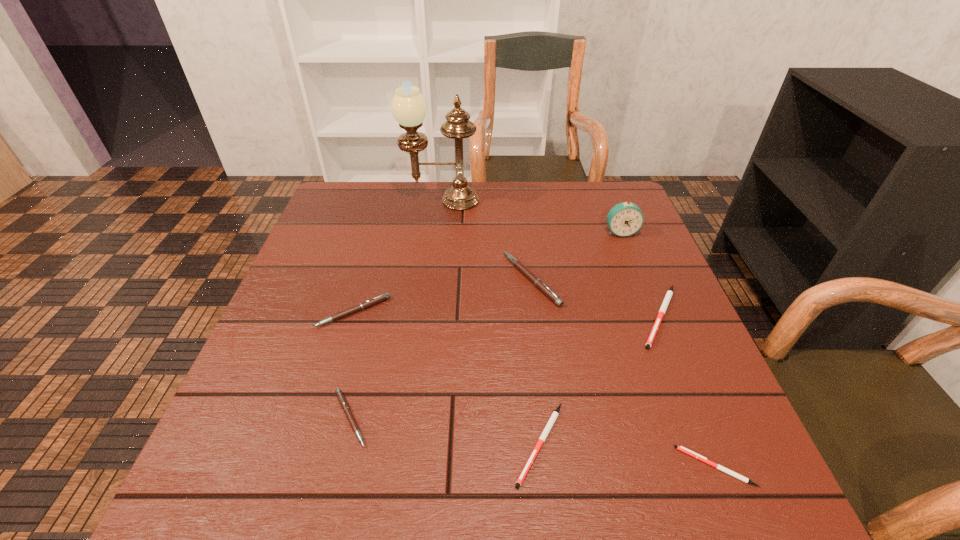
Identify the location of vacant space in between the blue alarm clock and the oil lamp. (531, 217).

You are a GUI agent. You are given a task and a screenshot of the screen. Output one action in this format:
    pyautogui.click(x=<x>, y=<y>)
    Task: Click on the free spot between the nearest pink pen and the sixth shortest object
    Image resolution: width=960 pixels, height=540 pixels.
    Given the screenshot: What is the action you would take?
    pyautogui.click(x=441, y=349)

The height and width of the screenshot is (540, 960). What are the coordinates of `free space between the second biggest pink pen and the nearest pink pen` in the screenshot? It's located at (351, 365).

The width and height of the screenshot is (960, 540). I want to click on vacant space that is in between the leftmost white pen and the biggest pink pen, so click(x=536, y=362).

Identify the location of free space between the shortest object and the biggest white pen. The width and height of the screenshot is (960, 540). (687, 392).

Locate which object is the fifth closest to the shortest pen. Please provide its 2D coordinates. Your answer should be formatted as a tuple, i.e. [(x, y)], where the tuple contains the x and y coordinates of a point satisfying the conditions above.

[(624, 219)]

Choose which object is the fifth nearest neighbor to the rightmost pink pen. Please provide its 2D coordinates. Your answer should be formatted as a tuple, i.e. [(x, y)], where the tuple contains the x and y coordinates of a point satisfying the conditions above.

[(380, 298)]

This screenshot has height=540, width=960. I want to click on pen that is the closest to the oil lamp, so click(538, 283).

Locate an element on the screen. pen that is the fifth closest to the biggest white pen is located at coordinates (380, 298).

Find the location of a particular element. Image resolution: width=960 pixels, height=540 pixels. pink pen that stands as the closest to the third tallest object is located at coordinates (380, 298).